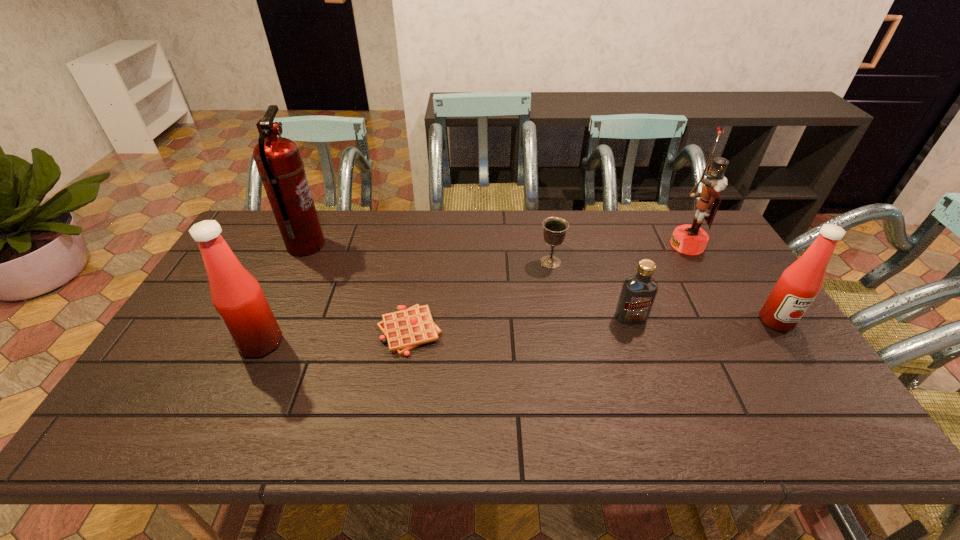
This screenshot has width=960, height=540. Identify the location of vacant space at the right edge of the desktop. (745, 288).

In the image, there is a desktop. Where is `vacant space at the far left corner`? vacant space at the far left corner is located at coordinates (263, 238).

Identify the location of vacant area that lies between the fire extinguisher and the sixth tallest object. The height and width of the screenshot is (540, 960). (428, 254).

Where is `free space between the third object from right to left and the left condiment`? free space between the third object from right to left and the left condiment is located at coordinates (445, 330).

Locate an element on the screen. Image resolution: width=960 pixels, height=540 pixels. vacant area that lies between the rightmost object and the taller condiment is located at coordinates (518, 332).

What are the coordinates of `free space between the waffle and the taller condiment` in the screenshot? It's located at (335, 337).

This screenshot has width=960, height=540. Find the location of `vacant space that is in between the rightmost object and the left condiment`. vacant space that is in between the rightmost object and the left condiment is located at coordinates (518, 332).

Identify the location of unoccupied position between the left condiment and the nutcracker. This screenshot has height=540, width=960. (474, 294).

I want to click on vacant space in between the fifth object from left to right and the shortest object, so click(520, 324).

Identify the location of vacant area that lies between the third object from left to right and the left condiment. [x=335, y=337].